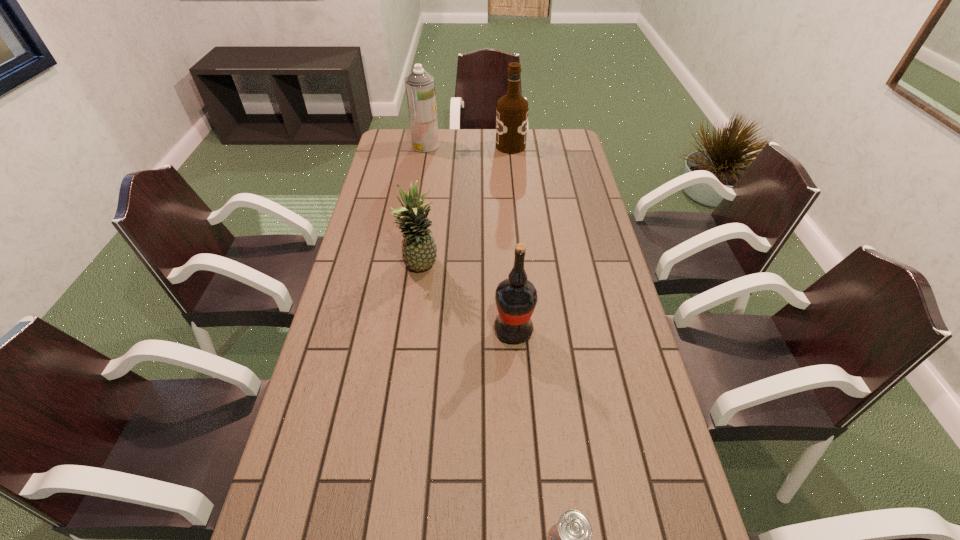
Locate an element on the screen. empty space between the second nearest object and the alcohol is located at coordinates (512, 238).

Where is `vacant area that lies between the alcohol and the aerosol can`? vacant area that lies between the alcohol and the aerosol can is located at coordinates (468, 146).

Find the location of a particular element. blank region between the alcohol and the aerosol can is located at coordinates coord(468,146).

The image size is (960, 540). What are the coordinates of `the closest object to the alcohol` in the screenshot? It's located at (420, 88).

Identify which object is the nearest to the aerosol can. Please provide its 2D coordinates. Your answer should be formatted as a tuple, i.e. [(x, y)], where the tuple contains the x and y coordinates of a point satisfying the conditions above.

[(512, 109)]

Find the location of a particular element. Image resolution: width=960 pixels, height=540 pixels. blank area in the image that satisfies the following two spatial constraints: 1. on the front side of the pineapple; 2. on the right side of the second nearest object is located at coordinates (412, 330).